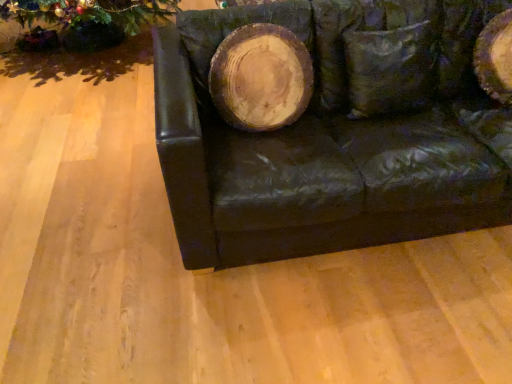
What are the coordinates of `vacant position to the left of matte black leather couch at center` in the screenshot? It's located at (98, 198).